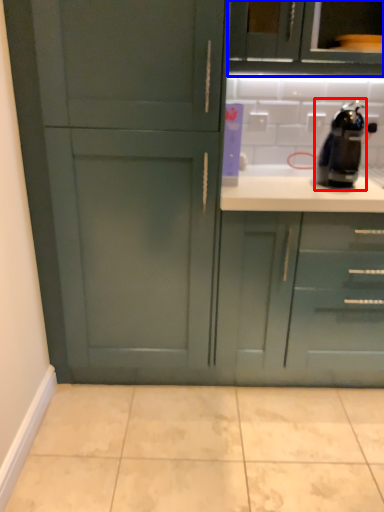
Question: Which point is closer to the camera, coffee machine (highlighted by a red box) or cabinetry (highlighted by a blue box)?

Choices:
 (A) coffee machine
 (B) cabinetry

Answer: (A)